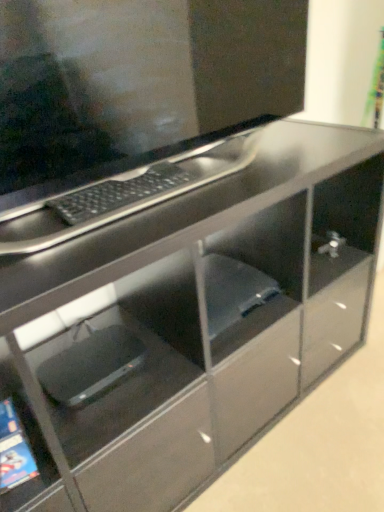
The image size is (384, 512). What are the coordinates of `empty space that is ontop of black plastic laptop at lower left` in the screenshot? It's located at (99, 354).